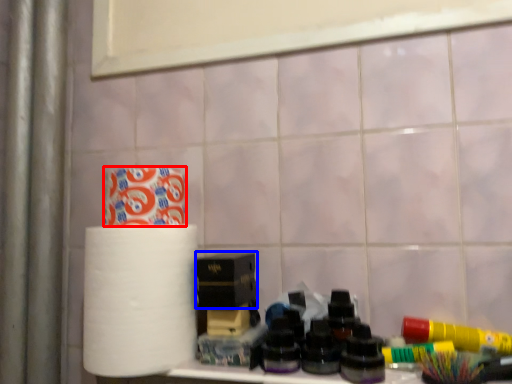
Question: Which object appears closest to the camera in this image, toilet paper (highlighted by a red box) or box (highlighted by a blue box)?

Choices:
 (A) toilet paper
 (B) box

Answer: (A)